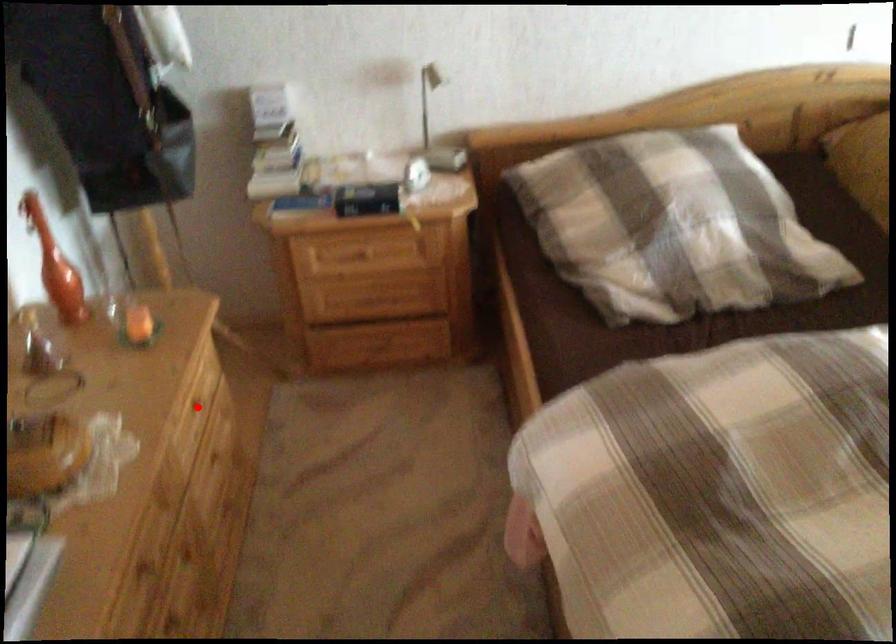
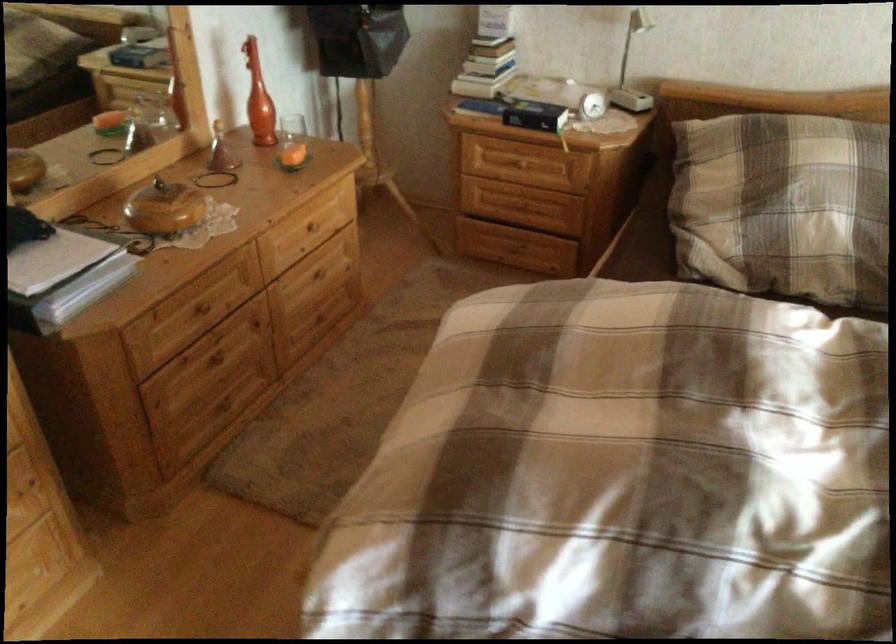
Where in the second image is the point corresponding to the highlighted location from the first image?

(308, 225)